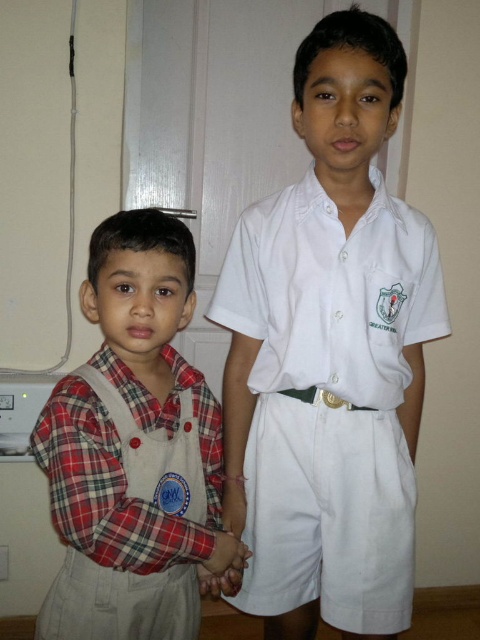
Can you confirm if white cotton shirt at center is positioned to the right of plaid fabric shirt at left?

Yes, white cotton shirt at center is to the right of plaid fabric shirt at left.

Can you confirm if white cotton shirt at center is thinner than plaid fabric shirt at left?

No, white cotton shirt at center is not thinner than plaid fabric shirt at left.

What do you see at coordinates (330, 355) in the screenshot?
I see `white cotton shirt at center` at bounding box center [330, 355].

Where is `white cotton shirt at center`? The width and height of the screenshot is (480, 640). white cotton shirt at center is located at coordinates (330, 355).